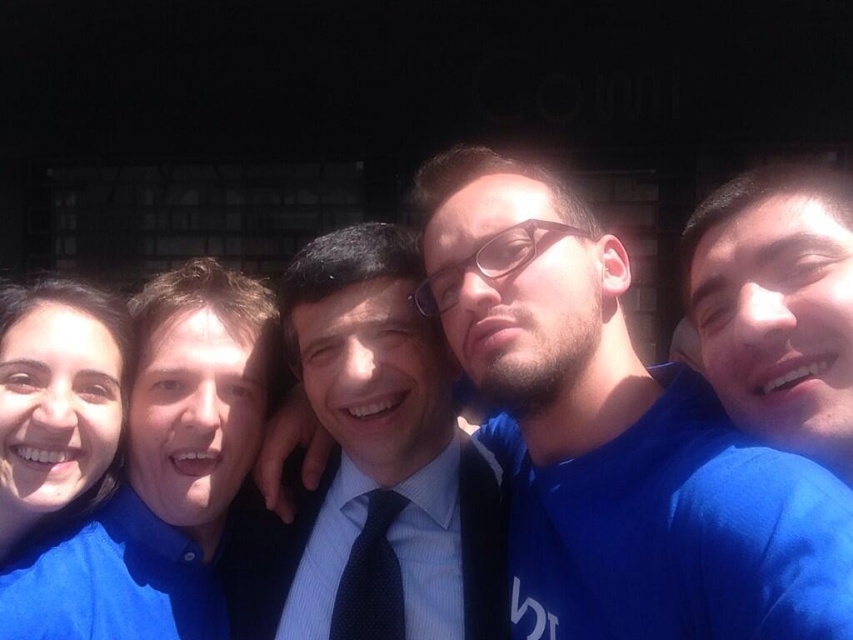
Does blue fabric shirt at center have a lesser height compared to matte blue shirt at left?

In fact, blue fabric shirt at center may be taller than matte blue shirt at left.

Is blue fabric shirt at center to the left of matte blue shirt at left from the viewer's perspective?

No, blue fabric shirt at center is not to the left of matte blue shirt at left.

Measure the distance between point (x=648, y=602) and camera.

Point (x=648, y=602) is 4.27 feet from camera.

Where is `blue fabric shirt at center`? The image size is (853, 640). blue fabric shirt at center is located at coordinates (616, 435).

Is blue silk tie at center below matte blue shirt at left?

Yes, blue silk tie at center is below matte blue shirt at left.

From the picture: Can you confirm if blue silk tie at center is shorter than matte blue shirt at left?

No.

Where is `blue silk tie at center`? blue silk tie at center is located at coordinates (380, 465).

Who is positioned more to the left, blue silk tie at center or dark blue dotted tie at center?

Positioned to the left is blue silk tie at center.

Between blue silk tie at center and dark blue dotted tie at center, which one is positioned higher?

blue silk tie at center is higher up.

Is point (378, 625) farther from viewer compared to point (392, 509)?

No, (378, 625) is closer to viewer.

I want to click on blue silk tie at center, so click(380, 465).